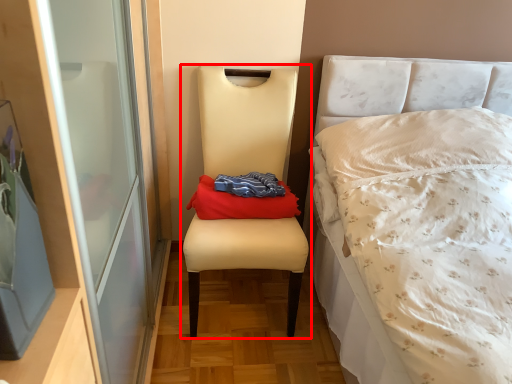
Question: From the image's perspective, what is the correct spatial relationship of chair (annotated by the red box) in relation to throw pillow?

Choices:
 (A) below
 (B) above

Answer: (A)